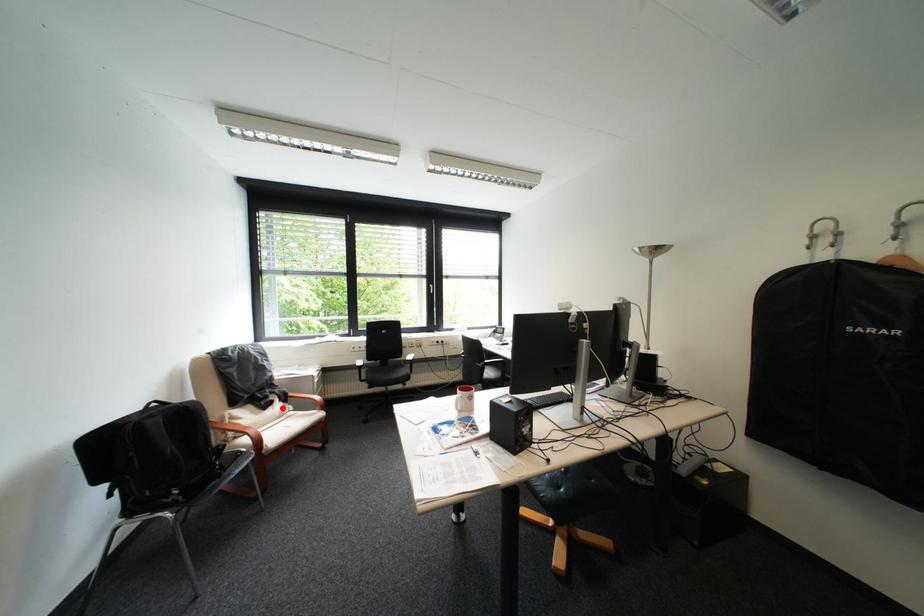
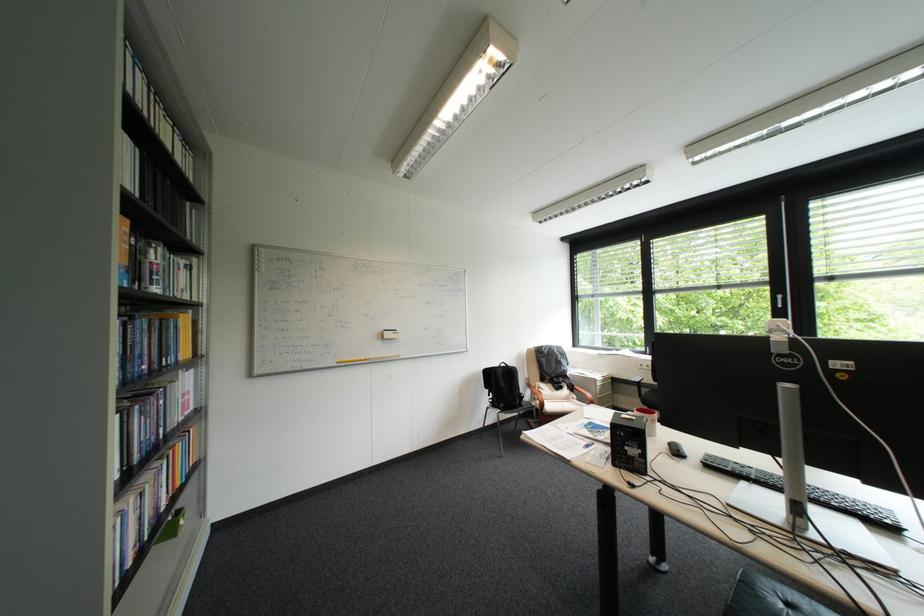
Question: I am providing you with two images of the same scene from different viewpoints. In image1, a red point is highlighted. Considering the same 3D point in image2, which of the following is correct?

Choices:
 (A) It is closer
 (B) It is farther

Answer: (B)